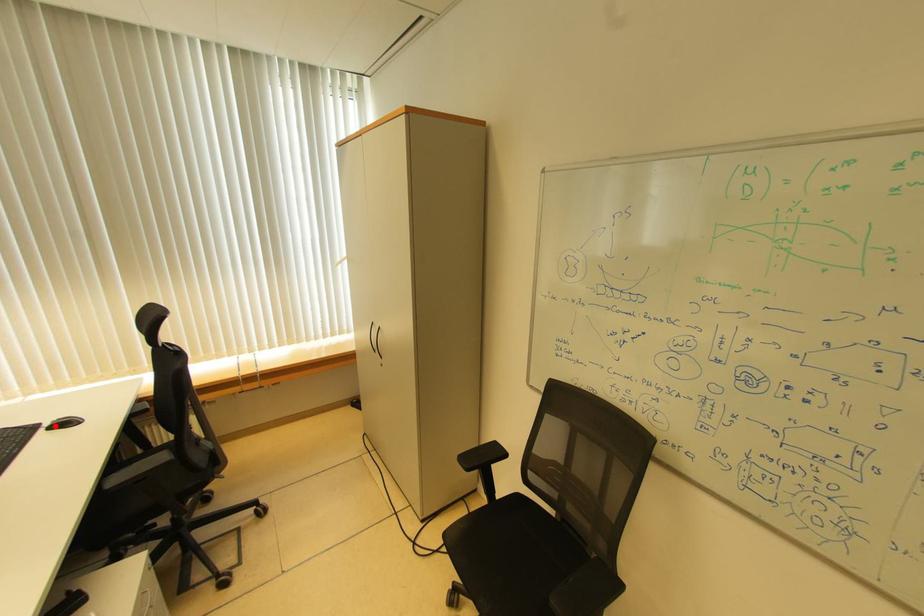
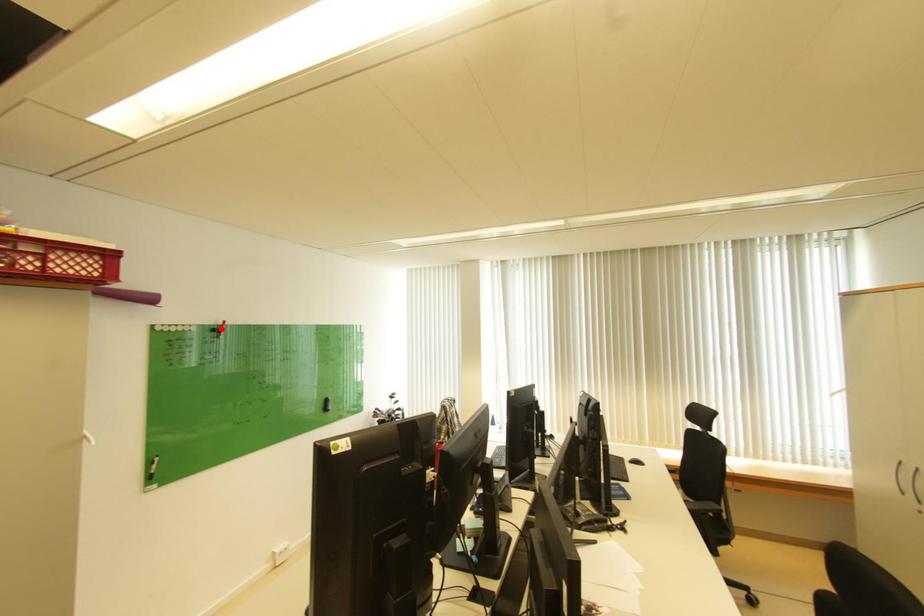
I am providing you with two images of the same scene from different viewpoints. A red point is marked on the first image and another point is marked on the second image. Is the red point in image1 aligned with the point shown in image2?

No